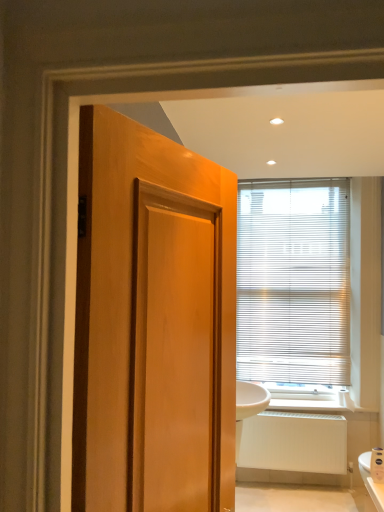
Question: From their relative heights in the image, would you say white textured blinds at upper center is taller or shorter than white matte radiator at lower right?

Choices:
 (A) short
 (B) tall

Answer: (B)

Question: From the image's perspective, is white textured blinds at upper center positioned above or below white matte radiator at lower right?

Choices:
 (A) above
 (B) below

Answer: (A)

Question: Which is correct: white textured blinds at upper center is inside white matte radiator at lower right, or outside of it?

Choices:
 (A) outside
 (B) inside

Answer: (A)

Question: Do you think white matte radiator at lower right is within white textured blinds at upper center, or outside of it?

Choices:
 (A) outside
 (B) inside

Answer: (A)

Question: Considering the relative positions of white matte radiator at lower right and white textured blinds at upper center in the image provided, is white matte radiator at lower right to the left or to the right of white textured blinds at upper center?

Choices:
 (A) right
 (B) left

Answer: (A)

Question: Is point (246, 451) closer or farther from the camera than point (336, 359)?

Choices:
 (A) farther
 (B) closer

Answer: (B)

Question: Looking at their shapes, would you say white matte radiator at lower right is wider or thinner than white textured blinds at upper center?

Choices:
 (A) thin
 (B) wide

Answer: (B)